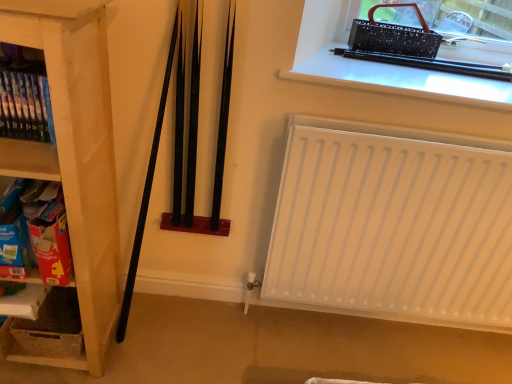
Question: In terms of width, does white cardboard box at lower left look wider or thinner when compared to white matte radiator at lower right?

Choices:
 (A) thin
 (B) wide

Answer: (B)

Question: In the image, is white cardboard box at lower left positioned in front of or behind white matte radiator at lower right?

Choices:
 (A) front
 (B) behind

Answer: (B)

Question: Estimate the real-world distances between objects in this image. Which object is farther from the wooden shelf at left, which ranks as the 2th shelf in top-to-bottom order?

Choices:
 (A) black plastic pen at upper right
 (B) white cardboard box at lower left
 (C) white matte radiator at lower right
 (D) cardboard box at left, the third shelf when ordered from top to bottom
 (E) wooden bookshelf at left, which ranks as the third shelf in bottom-to-top order

Answer: (C)

Question: Estimate the real-world distances between objects in this image. Which object is closer to the wooden shelf at left, which ranks as the 2th shelf in top-to-bottom order?

Choices:
 (A) white matte radiator at lower right
 (B) white cardboard box at lower left
 (C) black plastic pen at upper right
 (D) wooden bookshelf at left, placed as the first shelf when sorted from top to bottom
 (E) cardboard box at left, the first shelf from the bottom

Answer: (E)